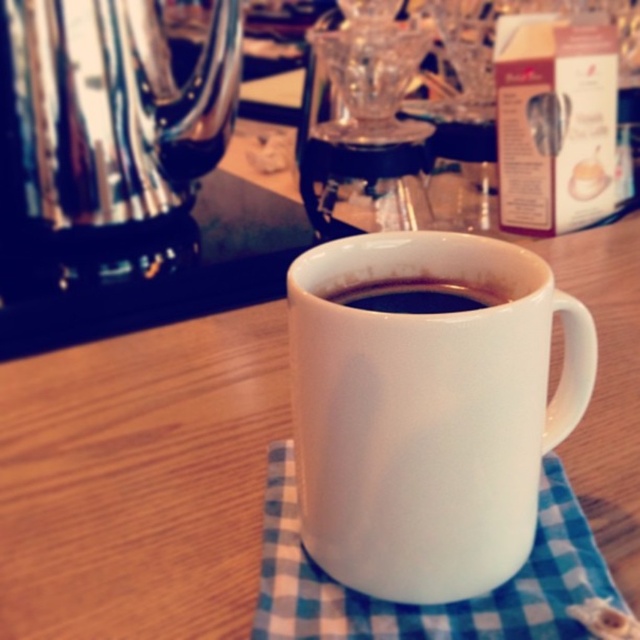
Question: Which object appears closest to the camera in this image?

Choices:
 (A) shiny metallic teapot at upper left
 (B) white ceramic mug at center
 (C) black glossy coffee at center
 (D) white checkered cloth at center

Answer: (B)

Question: Estimate the real-world distances between objects in this image. Which object is closer to the black glossy coffee at center?

Choices:
 (A) white checkered cloth at center
 (B) shiny metallic teapot at upper left

Answer: (A)

Question: Observing the image, what is the correct spatial positioning of white checkered cloth at center in reference to black glossy coffee at center?

Choices:
 (A) left
 (B) right

Answer: (B)

Question: Among these objects, which one is nearest to the camera?

Choices:
 (A) shiny metallic teapot at upper left
 (B) white checkered cloth at center
 (C) white ceramic mug at center
 (D) black glossy coffee at center

Answer: (C)

Question: Is white ceramic mug at center bigger than shiny metallic teapot at upper left?

Choices:
 (A) yes
 (B) no

Answer: (B)

Question: Is white ceramic mug at center positioned in front of white checkered cloth at center?

Choices:
 (A) yes
 (B) no

Answer: (A)